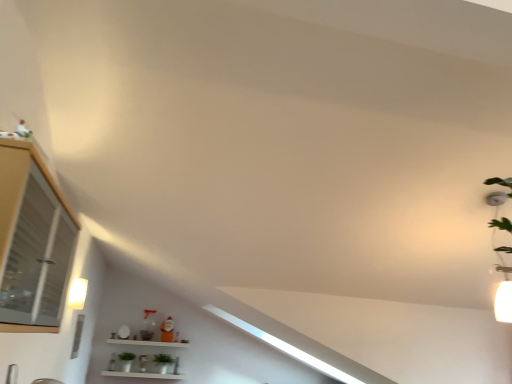
Question: Is the surface of green matte plant at lower center in direct contact with matte glass cabinet at left?

Choices:
 (A) yes
 (B) no

Answer: (B)

Question: Can you confirm if green matte plant at lower center is positioned to the right of matte glass cabinet at left?

Choices:
 (A) yes
 (B) no

Answer: (B)

Question: Is green matte plant at lower center oriented towards matte glass cabinet at left?

Choices:
 (A) no
 (B) yes

Answer: (B)

Question: Is green matte plant at lower center surrounding matte glass cabinet at left?

Choices:
 (A) no
 (B) yes

Answer: (A)

Question: From the image's perspective, is green matte plant at lower center over matte glass cabinet at left?

Choices:
 (A) yes
 (B) no

Answer: (B)

Question: Is green matte plant at lower center not near matte glass cabinet at left?

Choices:
 (A) no
 (B) yes

Answer: (B)

Question: From a real-world perspective, is white glossy shelf at lower center located beneath matte white light fixture at left?

Choices:
 (A) yes
 (B) no

Answer: (A)

Question: Is white glossy shelf at lower center not near matte white light fixture at left?

Choices:
 (A) yes
 (B) no

Answer: (A)

Question: Is white glossy shelf at lower center facing away from matte white light fixture at left?

Choices:
 (A) no
 (B) yes

Answer: (A)

Question: Does white glossy shelf at lower center have a greater height compared to matte white light fixture at left?

Choices:
 (A) no
 (B) yes

Answer: (B)

Question: From the image's perspective, is white glossy shelf at lower center beneath matte white light fixture at left?

Choices:
 (A) no
 (B) yes

Answer: (B)

Question: From the image's perspective, is white glossy shelf at lower center above matte white light fixture at left?

Choices:
 (A) no
 (B) yes

Answer: (A)

Question: Is matte glass cabinet at left far away from green matte plant at lower center?

Choices:
 (A) no
 (B) yes

Answer: (B)